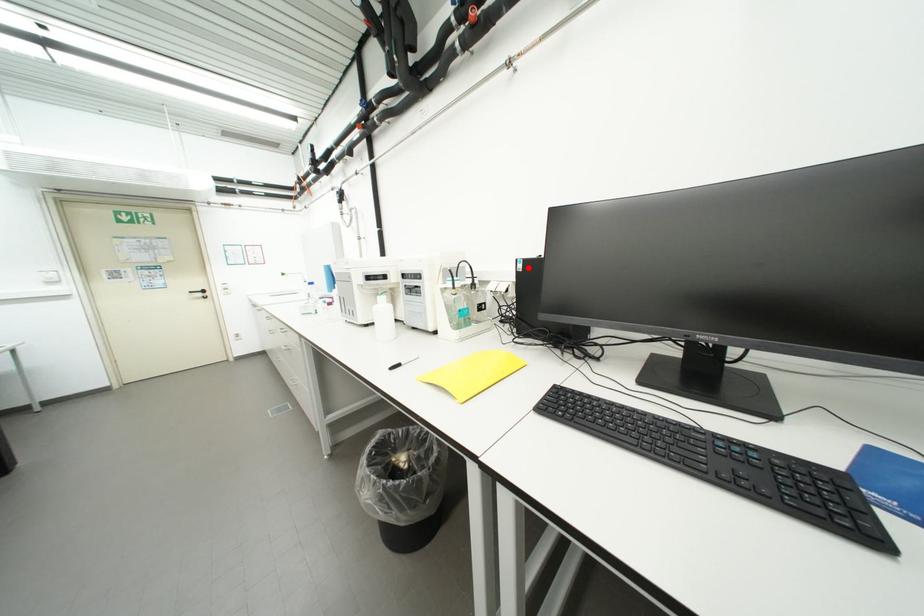
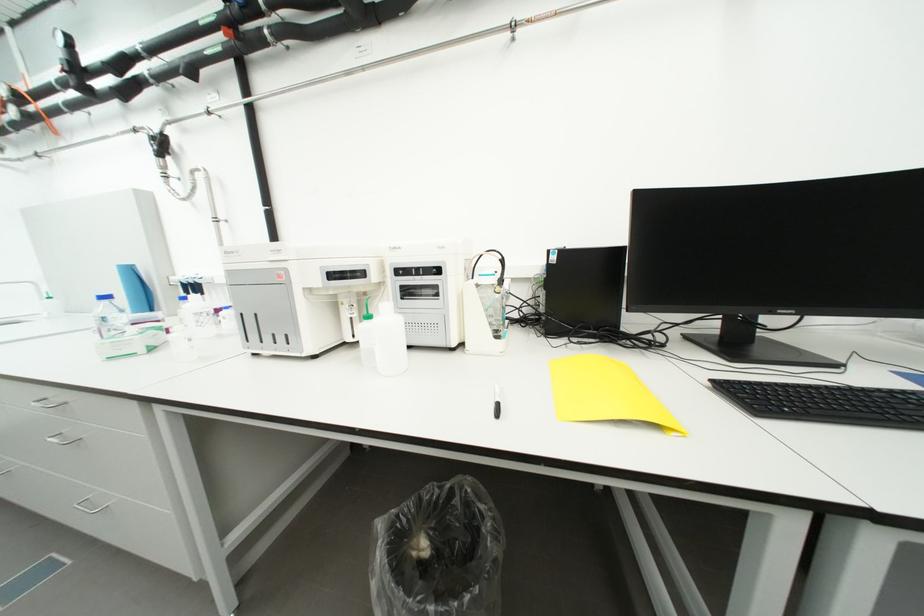
Locate, in the second image, the point that corresponds to the highlighted location in the first image.

(562, 259)